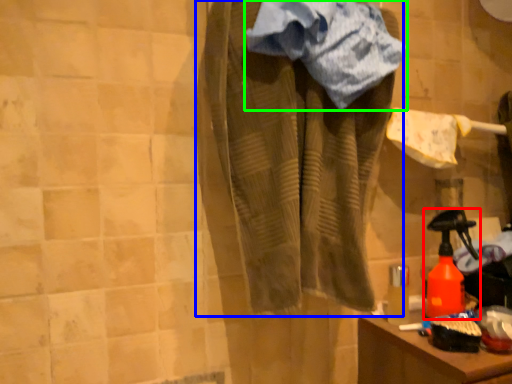
Question: Which is nearer to the bottle (highlighted by a red box)? clothing (highlighted by a blue box) or towel (highlighted by a green box).

Choices:
 (A) clothing
 (B) towel

Answer: (A)